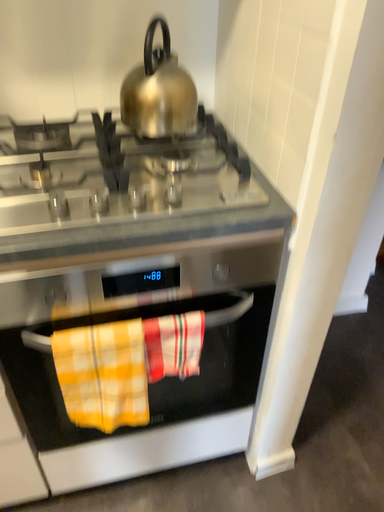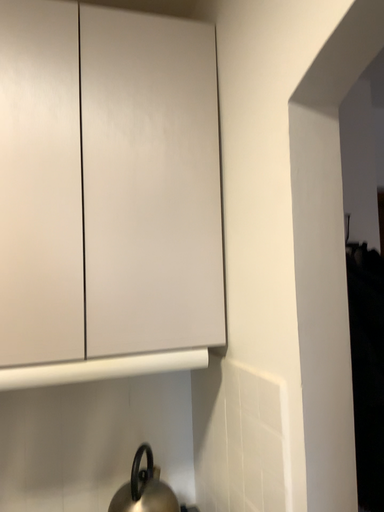
Question: Which way did the camera rotate in the video?

Choices:
 (A) rotated downward
 (B) rotated upward

Answer: (B)